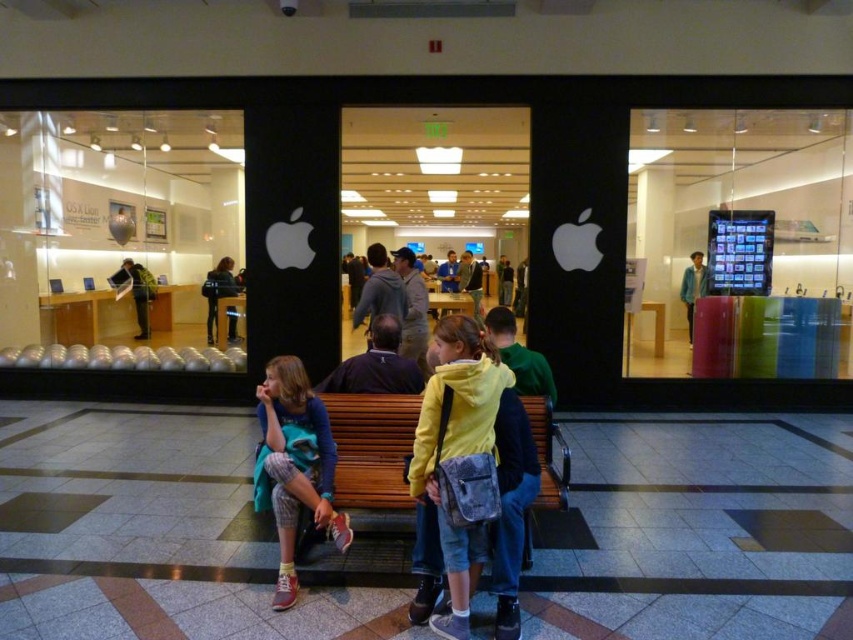
Is brown wooden bench at center taller than blue denim jacket at center?

Incorrect, brown wooden bench at center's height is not larger of blue denim jacket at center's.

Where is `brown wooden bench at center`? Image resolution: width=853 pixels, height=640 pixels. brown wooden bench at center is located at coordinates (370, 449).

Is yellow matte jacket at center below matte blue hoodie at center?

Incorrect, yellow matte jacket at center is not positioned below matte blue hoodie at center.

Between point (445, 628) and point (287, 508), which one is positioned in front?

Point (445, 628) is in front.

The width and height of the screenshot is (853, 640). In order to click on yellow matte jacket at center in this screenshot , I will do `click(456, 451)`.

Does dark blue hoodie at center have a larger size compared to green fabric jacket at center?

No, dark blue hoodie at center is not bigger than green fabric jacket at center.

Between point (212, 310) and point (115, 282), which one is positioned behind?

The point (115, 282) is more distant.

At what (x,y) coordinates should I click in order to perform the action: click on dark blue hoodie at center. Please return your answer as a coordinate pair (x, y). Looking at the image, I should click on (218, 291).